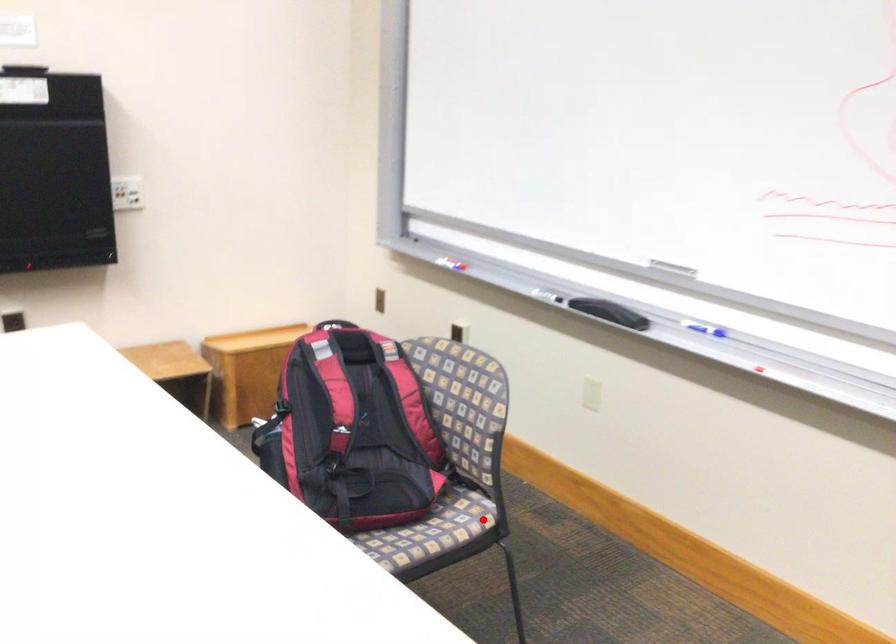
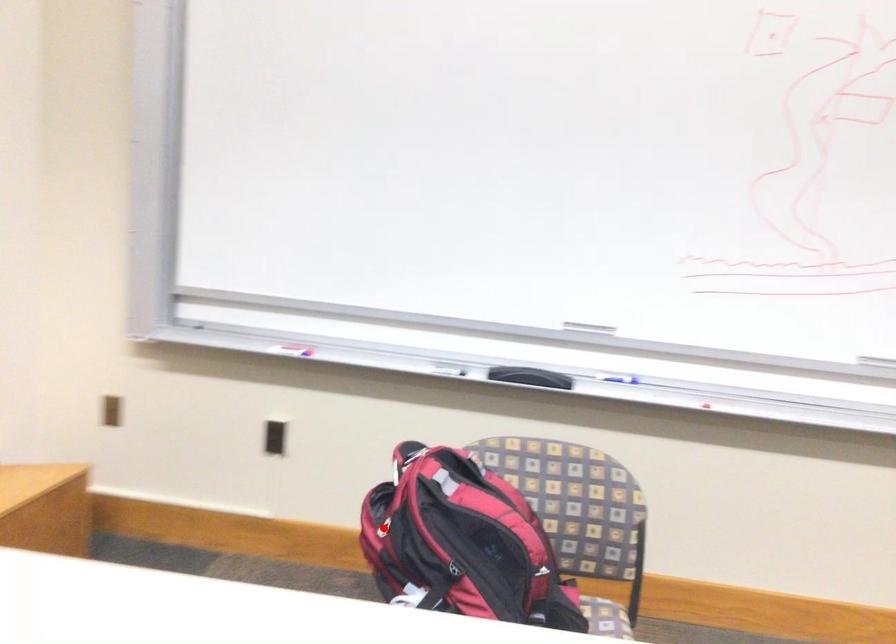
I am providing you with two images of the same scene from different viewpoints. A red point is marked on the first image and another point is marked on the second image. Is the red point in image1 aligned with the point shown in image2?

No